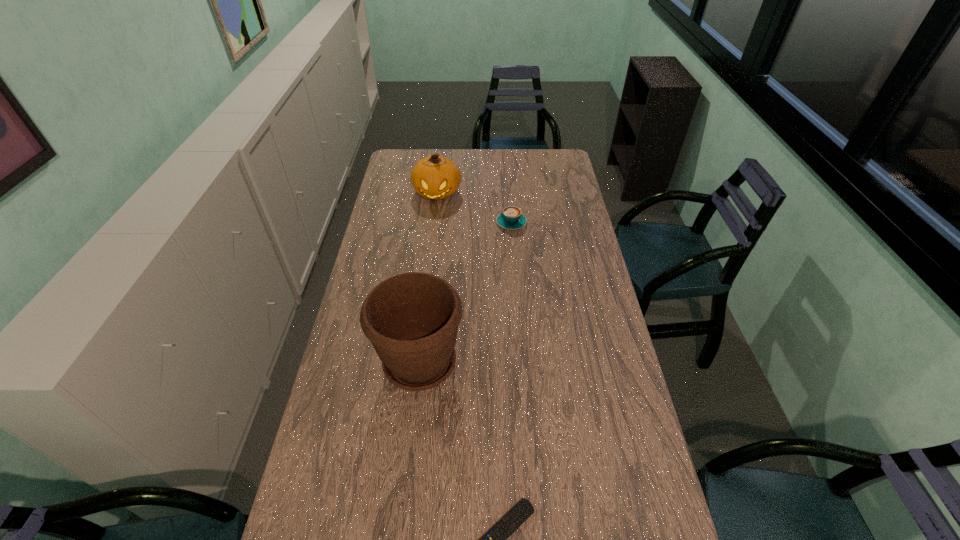
Identify which object is the third closest to the second tallest object. Please provide its 2D coordinates. Your answer should be formatted as a tuple, i.e. [(x, y)], where the tuple contains the x and y coordinates of a point satisfying the conditions above.

[(495, 539)]

Where is `object that ranks as the closest to the nearest object`? Image resolution: width=960 pixels, height=540 pixels. object that ranks as the closest to the nearest object is located at coordinates (411, 319).

This screenshot has height=540, width=960. I want to click on vacant space that satisfies the following two spatial constraints: 1. on the front face of the flowerpot; 2. on the left side of the pumpkin, so [417, 362].

You are a GUI agent. You are given a task and a screenshot of the screen. Output one action in this format:
    pyautogui.click(x=<x>, y=<y>)
    Task: Click on the free space that satisfies the following two spatial constraints: 1. on the front face of the pumpkin; 2. on the right side of the tallest object
    
    Given the screenshot: What is the action you would take?
    pyautogui.click(x=417, y=362)